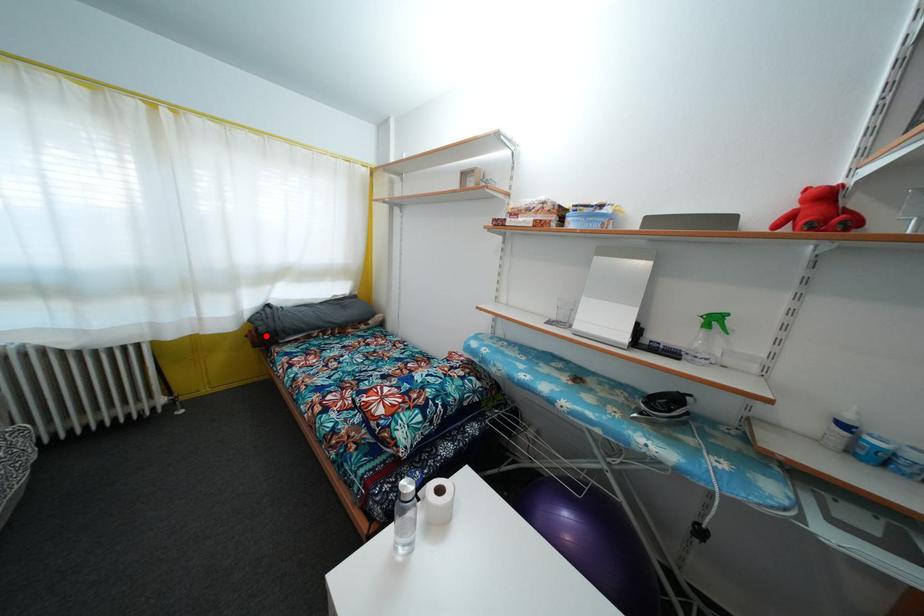
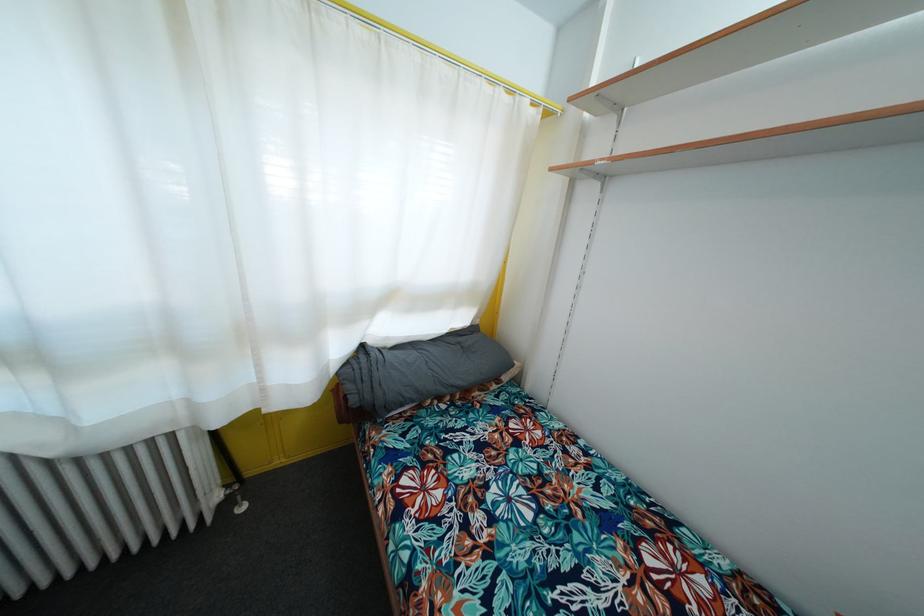
In the second image, find the point that corresponds to the highlighted location in the first image.

(358, 407)